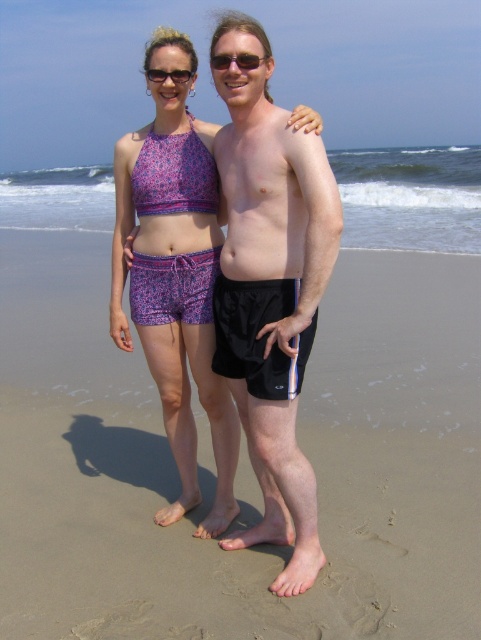
Question: Based on their relative distances, which object is farther from the black plastic sunglasses at upper center?

Choices:
 (A) printed fabric bikini top at center
 (B) sandy at center
 (C) black matte shorts at center

Answer: (B)

Question: Can you confirm if black matte shorts at center is positioned to the left of printed fabric bikini top at center?

Choices:
 (A) yes
 (B) no

Answer: (B)

Question: Which is nearer to the printed fabric bikini top at center?

Choices:
 (A) sandy at center
 (B) sunglasses at upper center
 (C) black matte shorts at center

Answer: (C)

Question: Among these points, which one is nearest to the camera?

Choices:
 (A) (151, 209)
 (B) (176, 593)

Answer: (B)

Question: Does sandy at center come behind sunglasses at upper center?

Choices:
 (A) yes
 (B) no

Answer: (B)

Question: Can you confirm if sandy at center is positioned to the left of sunglasses at upper center?

Choices:
 (A) no
 (B) yes

Answer: (B)